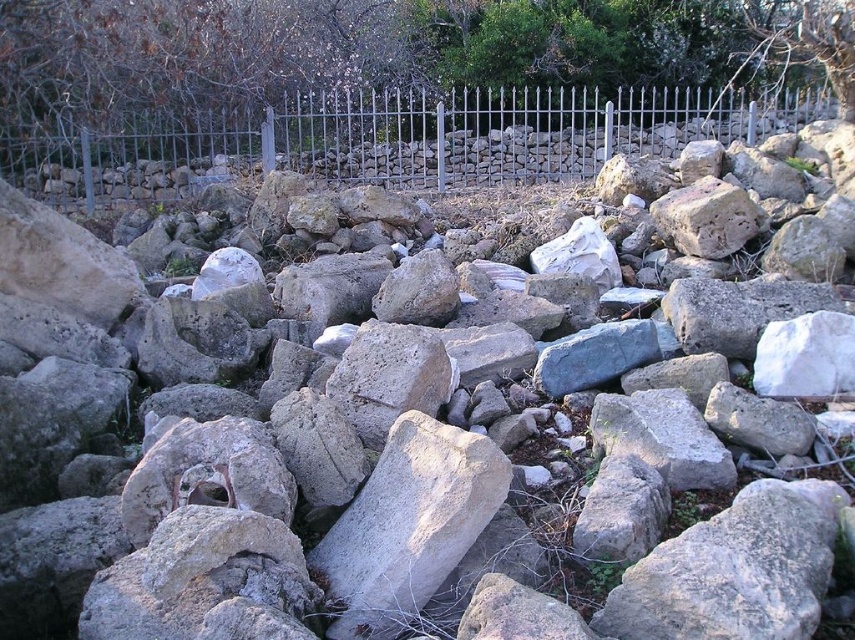
Question: Which point is farther from the camera taking this photo?

Choices:
 (A) (655, 33)
 (B) (585, 148)

Answer: (A)

Question: Can you confirm if green leafy tree at upper center is positioned above metallic fence at upper center?

Choices:
 (A) yes
 (B) no

Answer: (A)

Question: Is green leafy tree at upper center bigger than metallic fence at upper center?

Choices:
 (A) yes
 (B) no

Answer: (A)

Question: Among these points, which one is farthest from the camera?

Choices:
 (A) (158, 129)
 (B) (352, 51)

Answer: (B)

Question: Which object is farther from the camera taking this photo?

Choices:
 (A) metallic fence at upper center
 (B) green leafy tree at upper center

Answer: (A)

Question: Can you confirm if green leafy tree at upper center is positioned below metallic fence at upper center?

Choices:
 (A) yes
 (B) no

Answer: (B)